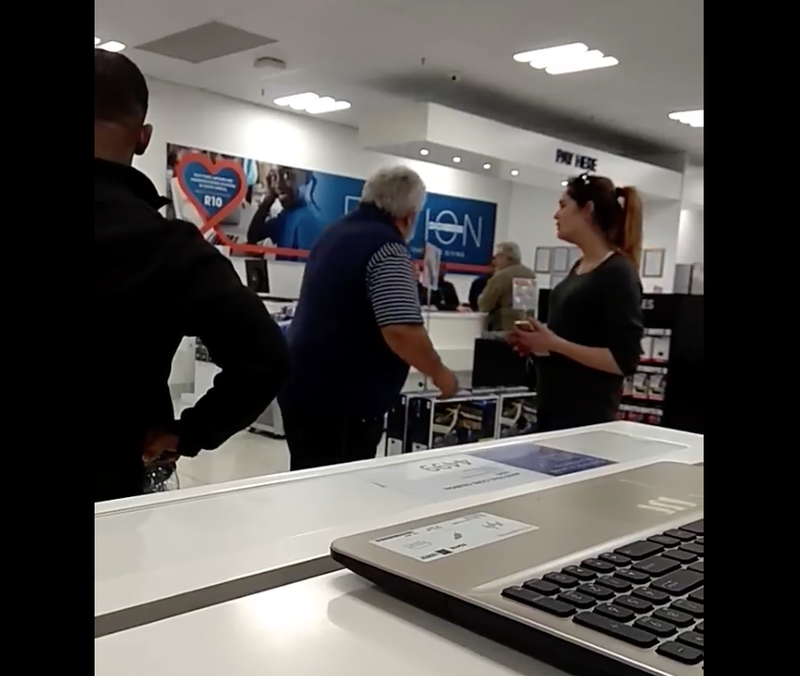
This screenshot has height=676, width=800. Identify the location of light. (586, 71).